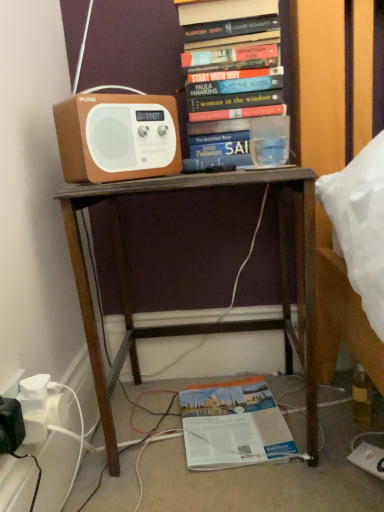
Describe the element at coordinates (233, 425) in the screenshot. I see `orange paper book at lower center, which appears as the 1th book when ordered from the bottom` at that location.

Image resolution: width=384 pixels, height=512 pixels. Identify the location of hardcover books at upper center, positioned as the 1th book in top-to-bottom order. tap(237, 104).

What are the coordinates of `brown wooden desk at center` in the screenshot? It's located at (199, 323).

From a real-world perspective, is brown wooden desk at center beneath brown matte speaker at upper left?

Yes.

The width and height of the screenshot is (384, 512). In order to click on desk below the brown matte speaker at upper left (from a real-world perspective) in this screenshot , I will do [199, 323].

Is brown matte speaker at upper left completely or partially inside brown wooden desk at center?

No, brown matte speaker at upper left is located outside of brown wooden desk at center.

Looking at this image, measure the distance from brown wooden desk at center to brown matte speaker at upper left.

They are 8.87 inches apart.

Are brown wooden desk at center and orange paper book at lower center, the 2th book from the top, beside each other?

brown wooden desk at center and orange paper book at lower center, the 2th book from the top, are not in contact.

Looking at this image, considering the positions of objects brown wooden desk at center and orange paper book at lower center, the 2th book from the top, in the image provided, who is in front, brown wooden desk at center or orange paper book at lower center, the 2th book from the top,?

brown wooden desk at center is in front.

Can you confirm if brown wooden desk at center is smaller than orange paper book at lower center, which appears as the 1th book when ordered from the bottom?

No.

Consider the image. Is brown wooden desk at center not inside orange paper book at lower center, which appears as the 1th book when ordered from the bottom?

Indeed, brown wooden desk at center is completely outside orange paper book at lower center, which appears as the 1th book when ordered from the bottom.

From a real-world perspective, which object stands above the other?

From a 3D spatial view, brown matte speaker at upper left is above.

Who is smaller, orange paper book at lower center, which appears as the 1th book when ordered from the bottom, or brown matte speaker at upper left?

brown matte speaker at upper left.

I want to click on book below the brown matte speaker at upper left (from a real-world perspective), so click(x=233, y=425).

Between orange paper book at lower center, the 2th book from the top, and brown wooden desk at center, which one appears on the right side from the viewer's perspective?

From the viewer's perspective, orange paper book at lower center, the 2th book from the top, appears more on the right side.

You are a GUI agent. You are given a task and a screenshot of the screen. Output one action in this format:
    pyautogui.click(x=<x>, y=<y>)
    Task: Click on the desk above the orange paper book at lower center, the 2th book from the top (from the image's perspective)
    This screenshot has width=384, height=512.
    Given the screenshot: What is the action you would take?
    pyautogui.click(x=199, y=323)

Considering the positions of objects orange paper book at lower center, the 2th book from the top, and brown wooden desk at center in the image provided, who is behind, orange paper book at lower center, the 2th book from the top, or brown wooden desk at center?

orange paper book at lower center, the 2th book from the top, is further away from the camera.

Is orange paper book at lower center, which appears as the 1th book when ordered from the bottom, inside the boundaries of brown wooden desk at center, or outside?

orange paper book at lower center, which appears as the 1th book when ordered from the bottom, lies within the bounds of brown wooden desk at center.

From a real-world perspective, is orange paper book at lower center, the 2th book from the top, located higher than hardcover books at upper center, placed as the second book when sorted from bottom to top?

Actually, orange paper book at lower center, the 2th book from the top, is physically below hardcover books at upper center, placed as the second book when sorted from bottom to top, in the real world.

Measure the distance from orange paper book at lower center, which appears as the 1th book when ordered from the bottom, to hardcover books at upper center, placed as the second book when sorted from bottom to top.

They are 25.21 inches apart.

In terms of size, does orange paper book at lower center, the 2th book from the top, appear bigger or smaller than hardcover books at upper center, placed as the second book when sorted from bottom to top?

In the image, orange paper book at lower center, the 2th book from the top, appears to be smaller than hardcover books at upper center, placed as the second book when sorted from bottom to top.

Locate an element on the screen. book on the right of hardcover books at upper center, placed as the second book when sorted from bottom to top is located at coordinates (233, 425).

Is point (102, 133) positioned after point (224, 441)?

That is False.

Locate an element on the screen. The height and width of the screenshot is (512, 384). speaker in front of the orange paper book at lower center, the 2th book from the top is located at coordinates point(117,137).

Based on the photo, from a real-world perspective, which object rests below the other?

From a 3D spatial view, orange paper book at lower center, which appears as the 1th book when ordered from the bottom, is below.

What's the angular difference between brown matte speaker at upper left and orange paper book at lower center, the 2th book from the top,'s facing directions?

34.6 degrees separate the facing orientations of brown matte speaker at upper left and orange paper book at lower center, the 2th book from the top.

Is hardcover books at upper center, positioned as the 1th book in top-to-bottom order, completely or partially outside of orange paper book at lower center, which appears as the 1th book when ordered from the bottom?

hardcover books at upper center, positioned as the 1th book in top-to-bottom order, lies outside orange paper book at lower center, which appears as the 1th book when ordered from the bottom,'s area.

Is hardcover books at upper center, positioned as the 1th book in top-to-bottom order, turned away from orange paper book at lower center, which appears as the 1th book when ordered from the bottom?

hardcover books at upper center, positioned as the 1th book in top-to-bottom order, is not turned away from orange paper book at lower center, which appears as the 1th book when ordered from the bottom.

Image resolution: width=384 pixels, height=512 pixels. What are the coordinates of `book located in front of the orange paper book at lower center, the 2th book from the top` in the screenshot? It's located at (237, 104).

Is hardcover books at upper center, placed as the second book when sorted from bottom to top, further to the viewer compared to orange paper book at lower center, the 2th book from the top?

No, hardcover books at upper center, placed as the second book when sorted from bottom to top, is in front of orange paper book at lower center, the 2th book from the top.

Identify the location of desk to the right of brown matte speaker at upper left. The image size is (384, 512). (199, 323).

Identify the location of desk positioned vertically above the orange paper book at lower center, which appears as the 1th book when ordered from the bottom (from a real-world perspective). This screenshot has width=384, height=512. (199, 323).

When comparing their distances from brown matte speaker at upper left, does brown wooden desk at center or orange paper book at lower center, which appears as the 1th book when ordered from the bottom, seem further?

The object further to brown matte speaker at upper left is orange paper book at lower center, which appears as the 1th book when ordered from the bottom.

From the image, which object appears to be farther from brown wooden desk at center, orange paper book at lower center, the 2th book from the top, or brown matte speaker at upper left?

orange paper book at lower center, the 2th book from the top, lies further to brown wooden desk at center than the other object.

Estimate the real-world distances between objects in this image. Which object is further from orange paper book at lower center, which appears as the 1th book when ordered from the bottom, brown matte speaker at upper left or brown wooden desk at center?

Based on the image, brown matte speaker at upper left appears to be further to orange paper book at lower center, which appears as the 1th book when ordered from the bottom.

From the image, which object appears to be farther from hardcover books at upper center, placed as the second book when sorted from bottom to top, brown matte speaker at upper left or orange paper book at lower center, which appears as the 1th book when ordered from the bottom?

Among the two, orange paper book at lower center, which appears as the 1th book when ordered from the bottom, is located further to hardcover books at upper center, placed as the second book when sorted from bottom to top.

Based on their spatial positions, is brown matte speaker at upper left or hardcover books at upper center, positioned as the 1th book in top-to-bottom order, closer to brown wooden desk at center?

The object closer to brown wooden desk at center is brown matte speaker at upper left.

From the image, which object appears to be nearer to brown matte speaker at upper left, orange paper book at lower center, the 2th book from the top, or hardcover books at upper center, placed as the second book when sorted from bottom to top?

hardcover books at upper center, placed as the second book when sorted from bottom to top, lies closer to brown matte speaker at upper left than the other object.

Which object lies further to the anchor point hardcover books at upper center, positioned as the 1th book in top-to-bottom order, brown wooden desk at center or orange paper book at lower center, the 2th book from the top?

orange paper book at lower center, the 2th book from the top, is positioned further to the anchor hardcover books at upper center, positioned as the 1th book in top-to-bottom order.

Based on their spatial positions, is brown matte speaker at upper left or orange paper book at lower center, which appears as the 1th book when ordered from the bottom, further from brown wooden desk at center?

orange paper book at lower center, which appears as the 1th book when ordered from the bottom, lies further to brown wooden desk at center than the other object.

The image size is (384, 512). In order to click on desk between hardcover books at upper center, positioned as the 1th book in top-to-bottom order, and orange paper book at lower center, which appears as the 1th book when ordered from the bottom, in the up-down direction in this screenshot , I will do `click(199, 323)`.

Where is `speaker between hardcover books at upper center, positioned as the 1th book in top-to-bottom order, and brown wooden desk at center vertically`? This screenshot has height=512, width=384. speaker between hardcover books at upper center, positioned as the 1th book in top-to-bottom order, and brown wooden desk at center vertically is located at coordinates (117, 137).

In order to click on desk between brown matte speaker at upper left and orange paper book at lower center, which appears as the 1th book when ordered from the bottom, in the vertical direction in this screenshot , I will do `click(199, 323)`.

You are a GUI agent. You are given a task and a screenshot of the screen. Output one action in this format:
    pyautogui.click(x=<x>, y=<y>)
    Task: Click on the speaker between hardcover books at upper center, placed as the second book when sorted from bottom to top, and orange paper book at lower center, which appears as the 1th book when ordered from the bottom, from top to bottom
    
    Given the screenshot: What is the action you would take?
    pyautogui.click(x=117, y=137)